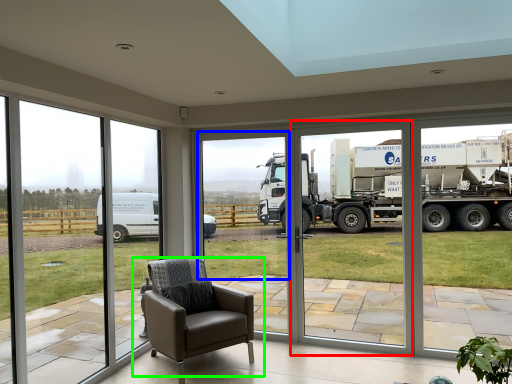
Question: Based on their relative distances, which object is farther from screen door (highlighted by a red box)? Choose from window screen (highlighted by a blue box) and chair (highlighted by a green box).

Choices:
 (A) window screen
 (B) chair

Answer: (B)